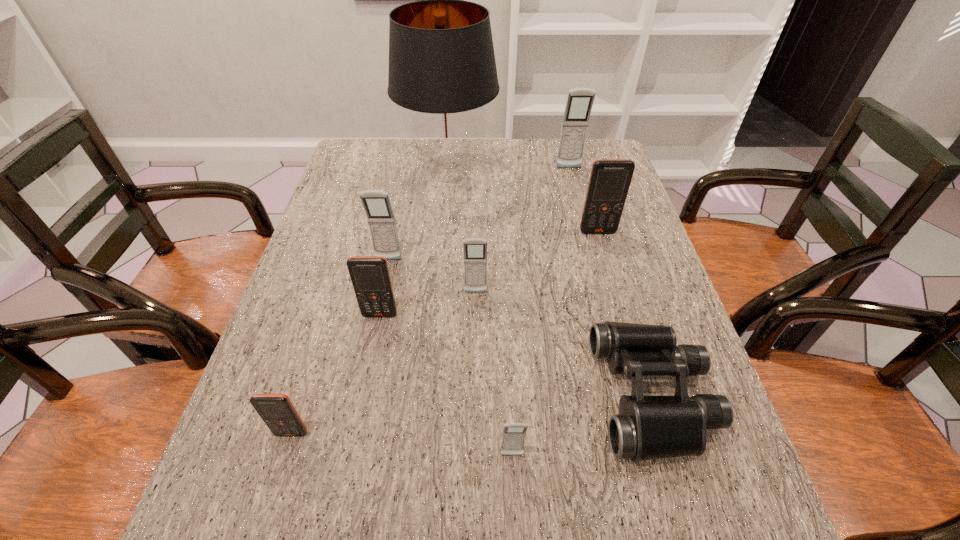
Identify which object is the eighth nearest to the sixth nearest object. Please provide its 2D coordinates. Your answer should be formatted as a tuple, i.e. [(x, y)], where the tuple contains the x and y coordinates of a point satisfying the conditions above.

[(579, 103)]

Identify which cellular telephone is the second nearest to the lampshade. Please provide its 2D coordinates. Your answer should be formatted as a tuple, i.e. [(x, y)], where the tuple contains the x and y coordinates of a point satisfying the conditions above.

[(376, 203)]

Identify which cellular telephone is located as the third nearest to the black binoculars. Please provide its 2D coordinates. Your answer should be formatted as a tuple, i.e. [(x, y)], where the tuple contains the x and y coordinates of a point satisfying the conditions above.

[(610, 179)]

Select which gray cellular telephone appears as the second closest to the second orange cellular telephone from left to right. Please provide its 2D coordinates. Your answer should be formatted as a tuple, i.e. [(x, y)], where the tuple contains the x and y coordinates of a point satisfying the conditions above.

[(475, 249)]

I want to click on gray cellular telephone that is the third closest to the smallest gray cellular telephone, so click(x=579, y=103).

Select which orange cellular telephone is the second closest to the gray lampshade. Please provide its 2D coordinates. Your answer should be formatted as a tuple, i.e. [(x, y)], where the tuple contains the x and y coordinates of a point satisfying the conditions above.

[(370, 276)]

Select which orange cellular telephone is the second closest to the second gray cellular telephone from right to left. Please provide its 2D coordinates. Your answer should be formatted as a tuple, i.e. [(x, y)], where the tuple contains the x and y coordinates of a point satisfying the conditions above.

[(370, 276)]

Identify the location of free region that satisfies the following two spatial constraints: 1. on the front-facing side of the shortest object; 2. on the screen of the nearest orange cellular telephone. This screenshot has width=960, height=540. (664, 434).

Image resolution: width=960 pixels, height=540 pixels. In order to click on vacant space that satisfies the following two spatial constraints: 1. on the front-facing side of the binoculars; 2. on the front-facing side of the smallest gray cellular telephone in this screenshot , I will do `click(671, 455)`.

This screenshot has height=540, width=960. Identify the location of free region that satisfies the following two spatial constraints: 1. on the front-facing side of the shortest object; 2. on the screen of the nearest orange cellular telephone. (664, 434).